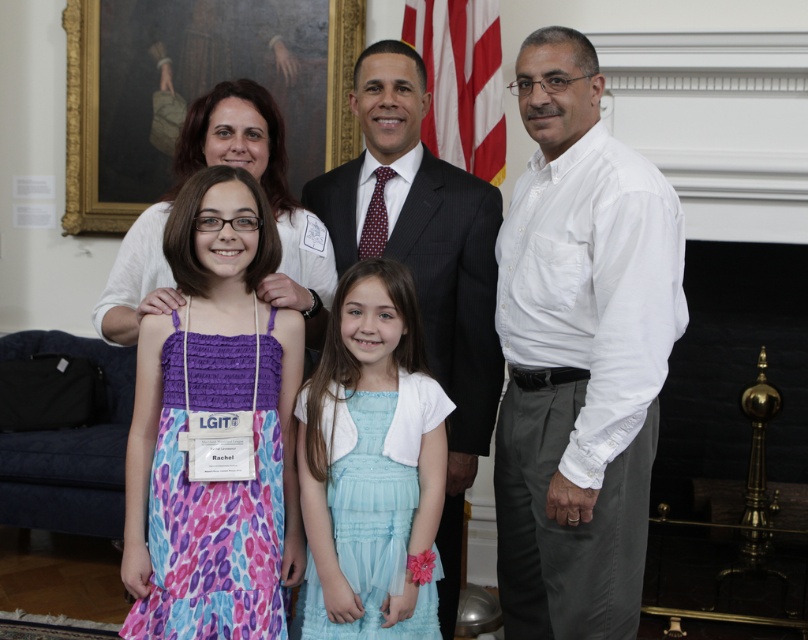
Question: Does matte white dress at center come in front of gold-framed portrait at upper center?

Choices:
 (A) no
 (B) yes

Answer: (B)

Question: Does dark gray suit at center have a greater width compared to light blue satin dress at center?

Choices:
 (A) no
 (B) yes

Answer: (B)

Question: Which point appears farthest from the camera in this image?

Choices:
 (A) (607, 428)
 (B) (613, 445)
 (C) (116, 132)
 (D) (145, 305)

Answer: (C)

Question: Does matte white dress at center have a lesser width compared to white fabric shirt at upper left?

Choices:
 (A) yes
 (B) no

Answer: (B)

Question: Which object is positioned farthest from the purple dotted dress at center?

Choices:
 (A) gold-framed portrait at upper center
 (B) white cotton shirt at right

Answer: (A)

Question: Which object appears farthest from the camera in this image?

Choices:
 (A) light blue satin dress at center
 (B) purple dotted dress at center
 (C) dark gray suit at center
 (D) matte white dress at center

Answer: (C)